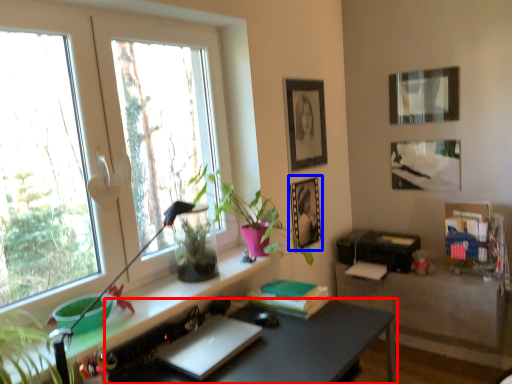
Question: Which object is further to the camera taking this photo, desk (highlighted by a red box) or picture frame (highlighted by a blue box)?

Choices:
 (A) desk
 (B) picture frame

Answer: (B)